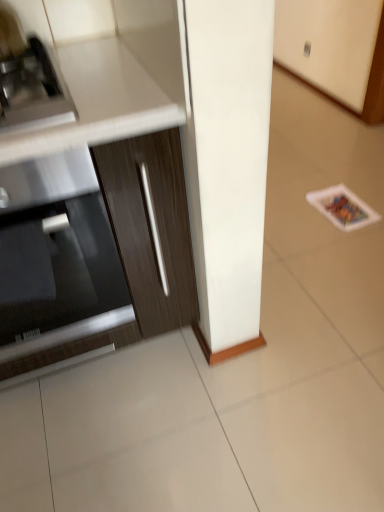
Where is `wooden cabinet at left`? The height and width of the screenshot is (512, 384). wooden cabinet at left is located at coordinates (138, 247).

Describe the element at coordinates (138, 247) in the screenshot. I see `wooden cabinet at left` at that location.

In order to click on wooden cabinet at left in this screenshot , I will do (138, 247).